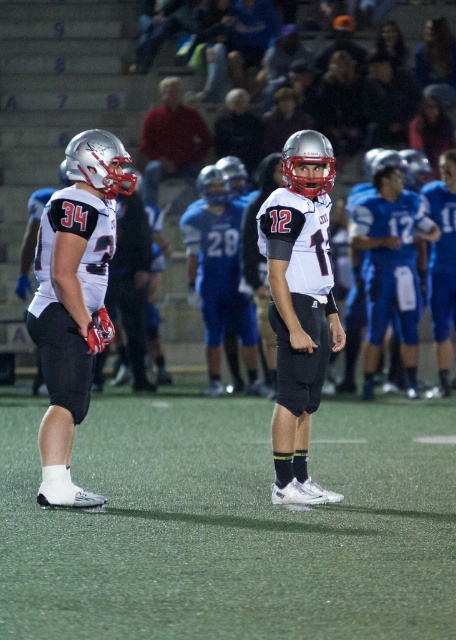
Does white matte jersey at left lie behind white matte jersey at center?

That is False.

Looking at this image, measure the distance from white matte jersey at left to white matte jersey at center.

A distance of 4.44 feet exists between white matte jersey at left and white matte jersey at center.

Between point (53, 228) and point (295, 481), which one is positioned behind?

The point (295, 481) is behind.

Identify the location of white matte jersey at left. The height and width of the screenshot is (640, 456). (74, 300).

Is white matte jersey at left smaller than blue fabric jersey at right?

Indeed, white matte jersey at left has a smaller size compared to blue fabric jersey at right.

Does white matte jersey at left come in front of blue fabric jersey at right?

Yes, white matte jersey at left is in front of blue fabric jersey at right.

Locate an element on the screen. This screenshot has height=640, width=456. white matte jersey at left is located at coordinates tap(74, 300).

You are a GUI agent. You are given a task and a screenshot of the screen. Output one action in this format:
    pyautogui.click(x=<x>, y=<y>)
    Task: Click on the white matte jersey at left
    The width and height of the screenshot is (456, 640).
    Given the screenshot: What is the action you would take?
    pyautogui.click(x=74, y=300)

Which is below, blue fabric jersey at right or dark blue jersey at center?

blue fabric jersey at right is below.

Does point (379, 294) come farther from viewer compared to point (253, 150)?

No, it is not.

Find the location of a particular element. The height and width of the screenshot is (640, 456). blue fabric jersey at right is located at coordinates (390, 268).